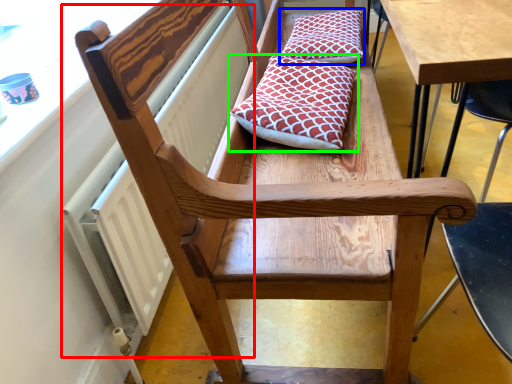
Question: Which object is positioned farthest from radiator (highlighted by a red box)? Select from pillow (highlighted by a blue box) and pillow (highlighted by a green box).

Choices:
 (A) pillow
 (B) pillow

Answer: (A)